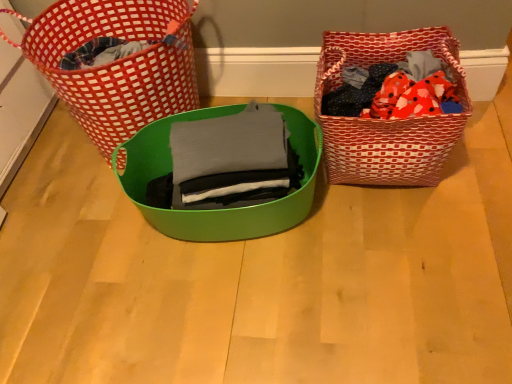
Question: Does green plastic bowl at center have a lesser width compared to red woven picnic basket at right, which is the second picnic basket from left to right?

Choices:
 (A) no
 (B) yes

Answer: (A)

Question: Is there a large distance between green plastic bowl at center and red woven picnic basket at right, which is the second picnic basket from left to right?

Choices:
 (A) yes
 (B) no

Answer: (B)

Question: Can you confirm if green plastic bowl at center is taller than red woven picnic basket at right, which is counted as the first picnic basket, starting from the right?

Choices:
 (A) yes
 (B) no

Answer: (B)

Question: Is green plastic bowl at center further to the viewer compared to red woven picnic basket at right, which is counted as the first picnic basket, starting from the right?

Choices:
 (A) yes
 (B) no

Answer: (B)

Question: Is green plastic bowl at center located outside red woven picnic basket at right, which is counted as the first picnic basket, starting from the right?

Choices:
 (A) yes
 (B) no

Answer: (A)

Question: Is green plastic bowl at center at the left side of red woven picnic basket at right, which is the second picnic basket from left to right?

Choices:
 (A) no
 (B) yes

Answer: (B)

Question: From a real-world perspective, is gray matte fabric at center physically below red woven picnic basket at left, the 2th picnic basket positioned from the right?

Choices:
 (A) yes
 (B) no

Answer: (B)

Question: Considering the relative positions of gray matte fabric at center and red woven picnic basket at left, the first picnic basket positioned from the left, in the image provided, is gray matte fabric at center behind red woven picnic basket at left, the first picnic basket positioned from the left,?

Choices:
 (A) yes
 (B) no

Answer: (B)

Question: Is gray matte fabric at center bigger than red woven picnic basket at left, the 2th picnic basket positioned from the right?

Choices:
 (A) no
 (B) yes

Answer: (A)

Question: Is gray matte fabric at center closer to camera compared to red woven picnic basket at left, the 2th picnic basket positioned from the right?

Choices:
 (A) no
 (B) yes

Answer: (B)

Question: From a real-world perspective, does gray matte fabric at center stand above red woven picnic basket at left, the first picnic basket positioned from the left?

Choices:
 (A) no
 (B) yes

Answer: (B)

Question: Is the surface of gray matte fabric at center in direct contact with red woven picnic basket at left, the 2th picnic basket positioned from the right?

Choices:
 (A) no
 (B) yes

Answer: (A)

Question: Considering the relative sizes of red woven picnic basket at left, the first picnic basket positioned from the left, and gray matte fabric at center in the image provided, is red woven picnic basket at left, the first picnic basket positioned from the left, thinner than gray matte fabric at center?

Choices:
 (A) yes
 (B) no

Answer: (B)